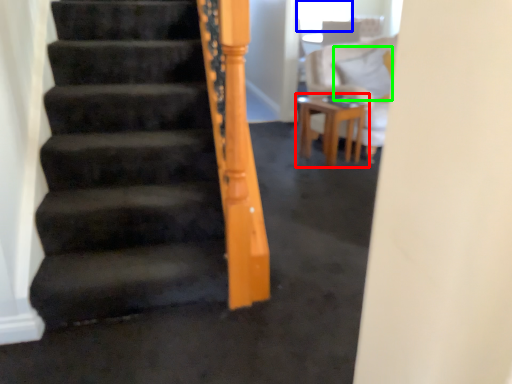
Question: Which object is the closest to the table (highlighted by a red box)? Choose among these: window screen (highlighted by a blue box) or pillow (highlighted by a green box).

Choices:
 (A) window screen
 (B) pillow

Answer: (B)